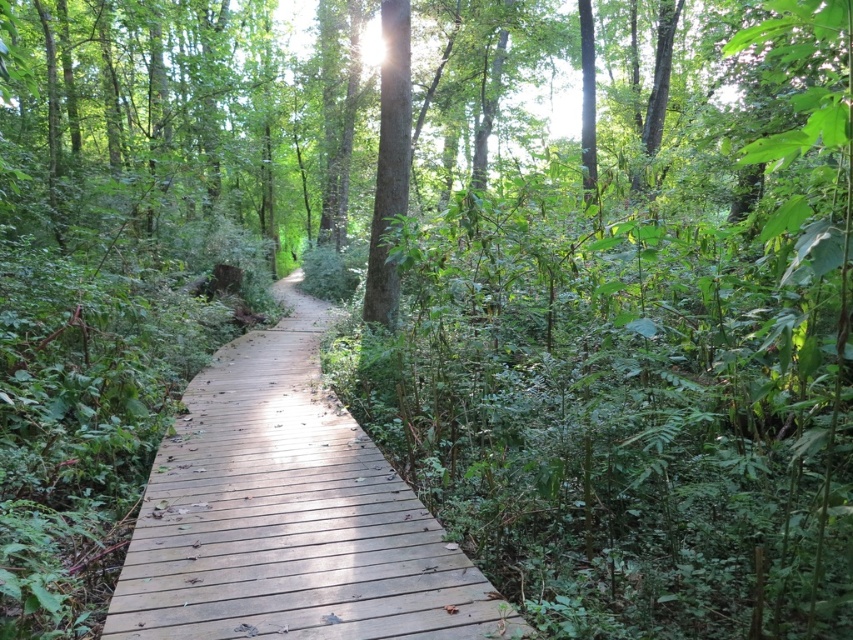
Describe the element at coordinates (288, 515) in the screenshot. I see `wooden at center` at that location.

Does wooden at center have a lesser height compared to green matte tree at center?

Indeed, wooden at center has a lesser height compared to green matte tree at center.

Where is `wooden at center`? This screenshot has height=640, width=853. wooden at center is located at coordinates (288, 515).